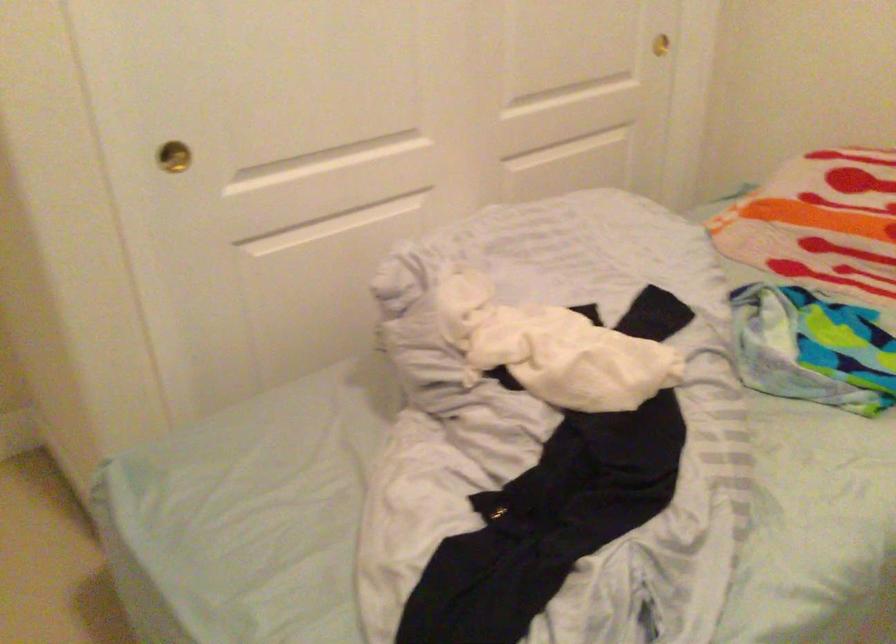
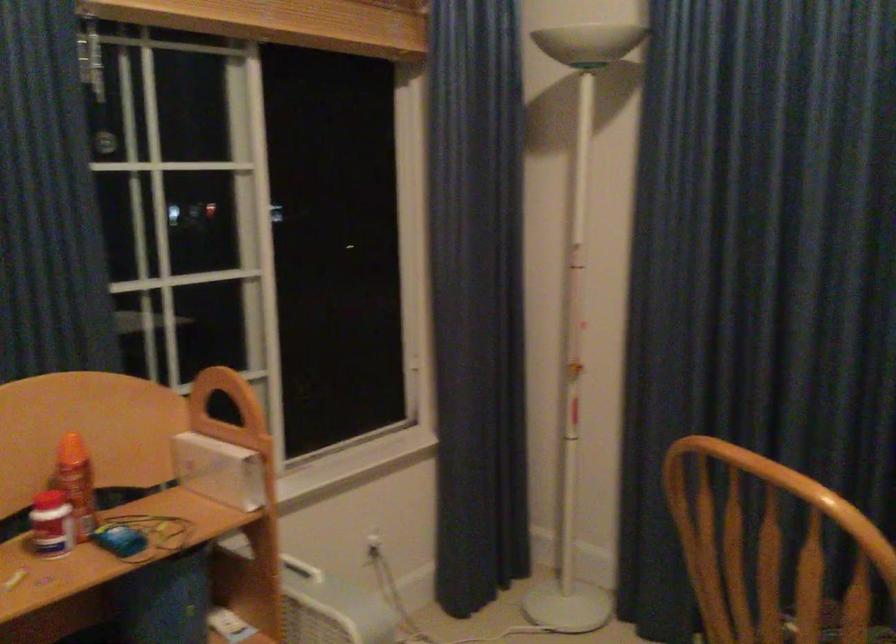
Question: The images are taken continuously from a first-person perspective. In which direction is your viewpoint rotating?

Choices:
 (A) Left
 (B) Right
 (C) Up
 (D) Down

Answer: (B)